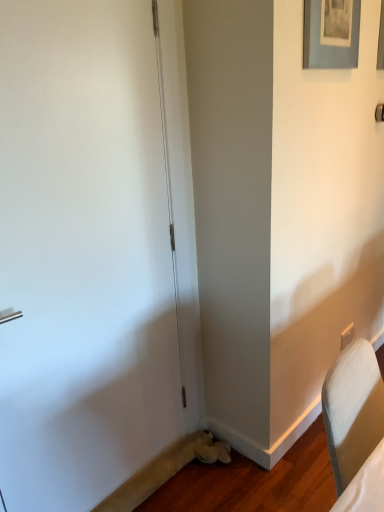
Question: Is matte gray picture frame at upper right beside beige plastic electric outlet at lower right?

Choices:
 (A) no
 (B) yes

Answer: (A)

Question: From the image's perspective, does matte gray picture frame at upper right appear higher than beige plastic electric outlet at lower right?

Choices:
 (A) no
 (B) yes

Answer: (B)

Question: Is matte gray picture frame at upper right located outside beige plastic electric outlet at lower right?

Choices:
 (A) no
 (B) yes

Answer: (B)

Question: Considering the relative positions of matte gray picture frame at upper right and beige plastic electric outlet at lower right in the image provided, is matte gray picture frame at upper right to the right of beige plastic electric outlet at lower right from the viewer's perspective?

Choices:
 (A) no
 (B) yes

Answer: (A)

Question: Is the depth of matte gray picture frame at upper right less than that of beige plastic electric outlet at lower right?

Choices:
 (A) yes
 (B) no

Answer: (A)

Question: Visually, is white matte door at left positioned to the left or to the right of matte gray picture frame at upper right?

Choices:
 (A) right
 (B) left

Answer: (B)

Question: From a real-world perspective, is white matte door at left positioned above or below matte gray picture frame at upper right?

Choices:
 (A) above
 (B) below

Answer: (B)

Question: Considering the positions of white matte door at left and matte gray picture frame at upper right in the image, is white matte door at left wider or thinner than matte gray picture frame at upper right?

Choices:
 (A) wide
 (B) thin

Answer: (A)

Question: From the image's perspective, is white matte door at left positioned above or below matte gray picture frame at upper right?

Choices:
 (A) above
 (B) below

Answer: (B)

Question: Is beige plastic electric outlet at lower right wider or thinner than matte gray picture frame at upper right?

Choices:
 (A) wide
 (B) thin

Answer: (B)

Question: Relative to matte gray picture frame at upper right, is beige plastic electric outlet at lower right in front or behind?

Choices:
 (A) behind
 (B) front

Answer: (A)

Question: From the image's perspective, is beige plastic electric outlet at lower right above or below matte gray picture frame at upper right?

Choices:
 (A) below
 (B) above

Answer: (A)

Question: Is point (344, 335) positioned closer to the camera than point (327, 32)?

Choices:
 (A) closer
 (B) farther

Answer: (A)

Question: Considering the positions of matte gray picture frame at upper right and beige plastic electric outlet at lower right in the image, is matte gray picture frame at upper right taller or shorter than beige plastic electric outlet at lower right?

Choices:
 (A) short
 (B) tall

Answer: (B)

Question: From the image's perspective, is matte gray picture frame at upper right positioned above or below beige plastic electric outlet at lower right?

Choices:
 (A) below
 (B) above

Answer: (B)